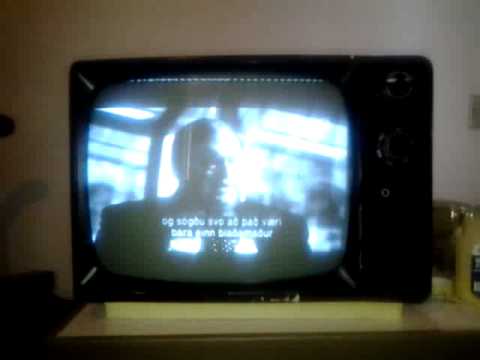
Where is `television set`? The image size is (480, 360). television set is located at coordinates (217, 161).